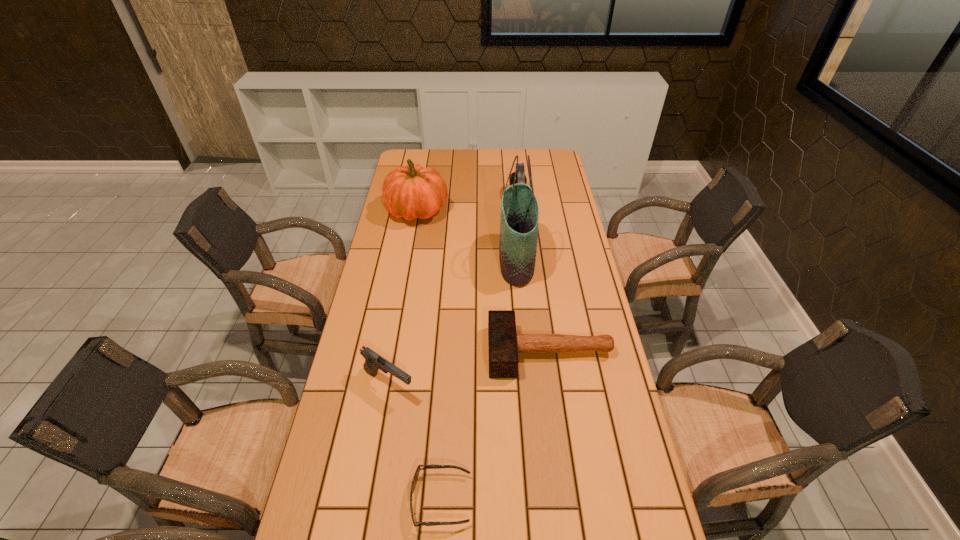
At what (x,y) coordinates should I click in order to perform the action: click on vacant area that lies between the fourth shortest object and the second shortest object. Please return your answer as a coordinate pair (x, y). The image size is (960, 540). Looking at the image, I should click on (534, 274).

Locate an element on the screen. The image size is (960, 540). free space between the second shortest object and the second tallest object is located at coordinates (484, 281).

You are a GUI agent. You are given a task and a screenshot of the screen. Output one action in this format:
    pyautogui.click(x=<x>, y=<y>)
    Task: Click on the free spot between the gun and the nearest object
    
    Given the screenshot: What is the action you would take?
    pyautogui.click(x=415, y=442)

Choose which object is the fourth nearest neighbor to the fifth shortest object. Please provide its 2D coordinates. Your answer should be formatted as a tuple, i.e. [(x, y)], where the tuple contains the x and y coordinates of a point satisfying the conditions above.

[(373, 362)]

Identify which object is the fifth nearest to the second shortest object. Please provide its 2D coordinates. Your answer should be formatted as a tuple, i.e. [(x, y)], where the tuple contains the x and y coordinates of a point satisfying the conditions above.

[(520, 176)]